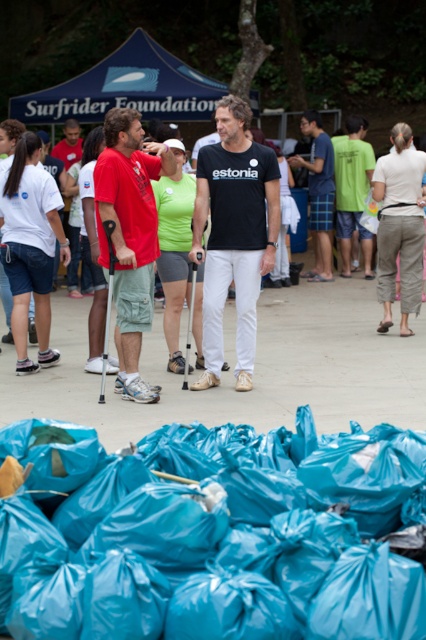
Which is above, black matte t-shirt at center or green cotton shirt at center?

Positioned higher is green cotton shirt at center.

Which is in front, point (241, 172) or point (342, 221)?

Point (241, 172)

The image size is (426, 640). What are the coordinates of `black matte t-shirt at center` in the screenshot? It's located at coord(233,234).

Who is higher up, blue plastic bags at lower center or black matte t-shirt at center?

black matte t-shirt at center is higher up.

Which is behind, point (169, 630) or point (207, 291)?

The point (207, 291) is behind.

Is point (112, 602) positioned after point (255, 164)?

No, it is not.

This screenshot has height=640, width=426. I want to click on blue plastic bags at lower center, so click(x=215, y=536).

Who is shorter, blue plastic bags at lower center or matte red shirt at left?

blue plastic bags at lower center

Is blue plastic bags at lower center further to camera compared to matte red shirt at left?

No, blue plastic bags at lower center is in front of matte red shirt at left.

Is point (376, 477) positioned in front of point (141, 225)?

That is True.

The image size is (426, 640). I want to click on blue plastic bags at lower center, so click(x=215, y=536).